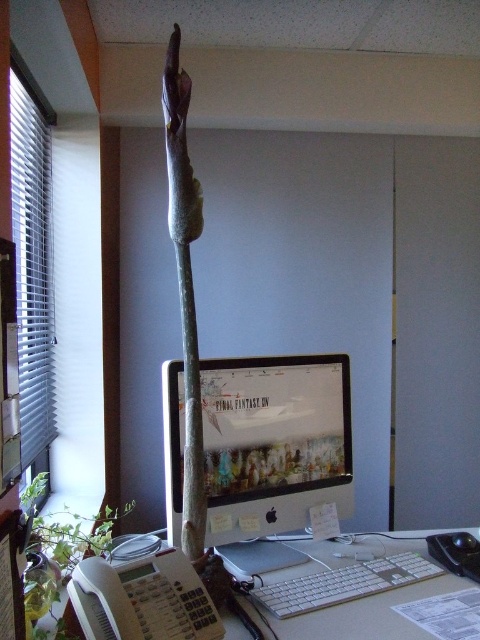
Question: Which point appears farthest from the camera in this image?

Choices:
 (A) (92, 554)
 (B) (321, 588)

Answer: (A)

Question: Considering the real-world distances, which object is farthest from the white plastic keyboard at center?

Choices:
 (A) white plastic keyboard at lower center
 (B) matte plastic monitor at center

Answer: (B)

Question: Where is white plastic keyboard at center located in relation to white plastic keyboard at lower center in the image?

Choices:
 (A) right
 (B) left

Answer: (A)

Question: Is white plastic keyboard at lower center above green leafy plant at lower left?

Choices:
 (A) no
 (B) yes

Answer: (B)

Question: Which point appears farthest from the camera in this image?

Choices:
 (A) (226, 534)
 (B) (282, 604)
 (C) (434, 593)

Answer: (A)

Question: Is white plastic keyboard at center positioned behind white plastic keyboard at lower center?

Choices:
 (A) yes
 (B) no

Answer: (B)